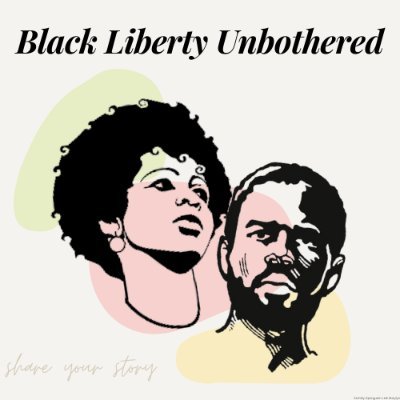
You are a GUI agent. You are given a task and a screenshot of the screen. Output one action in this format:
    pyautogui.click(x=<x>, y=<y>)
    Task: Click on the drawn pictures
    
    Given the screenshot: What is the action you would take?
    pyautogui.click(x=171, y=321), pyautogui.click(x=262, y=345)